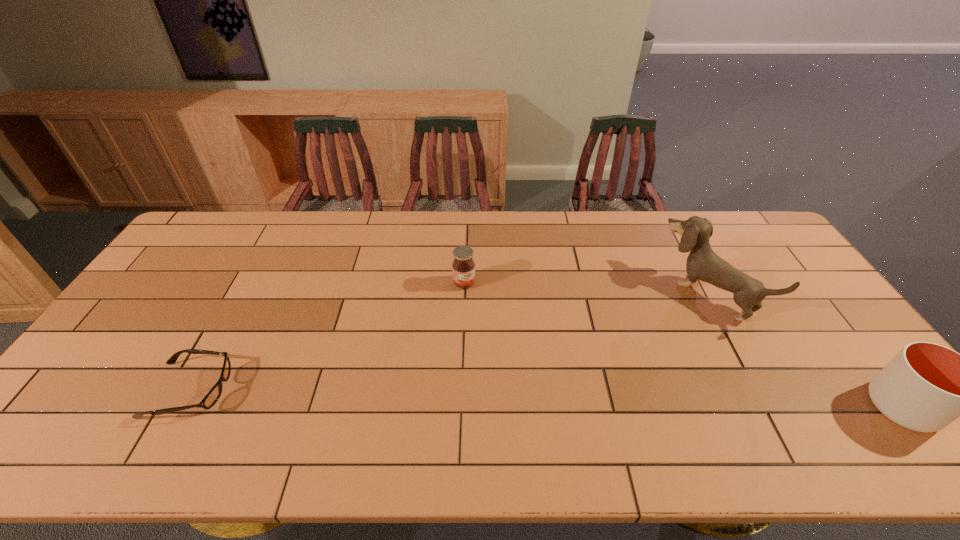
Identify the location of the shortest object. Image resolution: width=960 pixels, height=540 pixels. (211, 398).

I want to click on spectacles, so click(211, 398).

Find the location of a particular element. cup is located at coordinates (925, 387).

This screenshot has height=540, width=960. I want to click on the rightmost object, so click(x=925, y=387).

I want to click on the tallest object, so click(703, 264).

At what (x,y) coordinates should I click in order to perform the action: click on puppy. Please return your answer as a coordinate pair (x, y). This screenshot has height=540, width=960. Looking at the image, I should click on (703, 264).

The height and width of the screenshot is (540, 960). I want to click on the second object from left to right, so click(x=463, y=267).

Where is `the second shortest object`? The image size is (960, 540). the second shortest object is located at coordinates click(463, 267).

Find the location of a particular element. The width and height of the screenshot is (960, 540). vacant region located 0.280m on the front-facing side of the spectacles is located at coordinates (341, 390).

This screenshot has width=960, height=540. In order to click on free space located on the back of the third shortest object in this screenshot , I will do `click(806, 284)`.